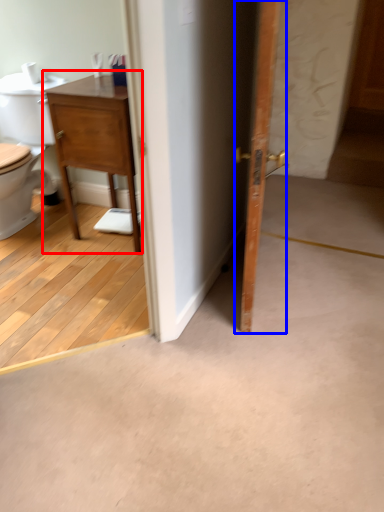
Question: Which object appears closest to the camera in this image, nightstand (highlighted by a red box) or door (highlighted by a blue box)?

Choices:
 (A) nightstand
 (B) door

Answer: (B)